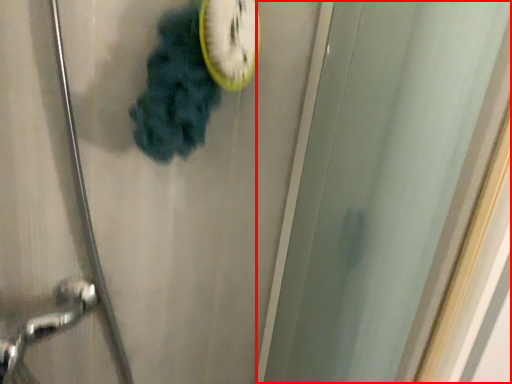
Question: From the image's perspective, where is screen door (annotated by the red box) located relative to clock?

Choices:
 (A) below
 (B) above

Answer: (A)